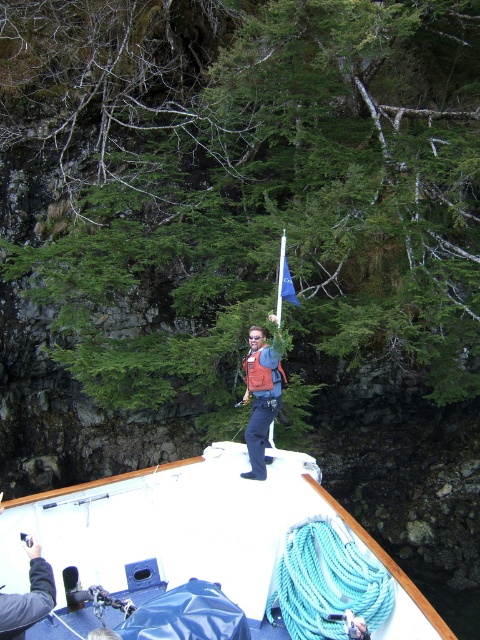
You are a passenger on a boat trip through a narrow waterway. You notice the white matte boat at center and the orange life vest at center. Which object is positioned higher from the ground?

The orange life vest at center is positioned higher from the ground than the white matte boat at center because the white matte boat at center is below the orange life vest at center.

You are a passenger on the white matte boat at center and want to reach the orange life vest at center. Which direction should you move to get closer to the life vest?

The white matte boat at center is in front of orange life vest at center, so you should move backward to get closer to the orange life vest at center.